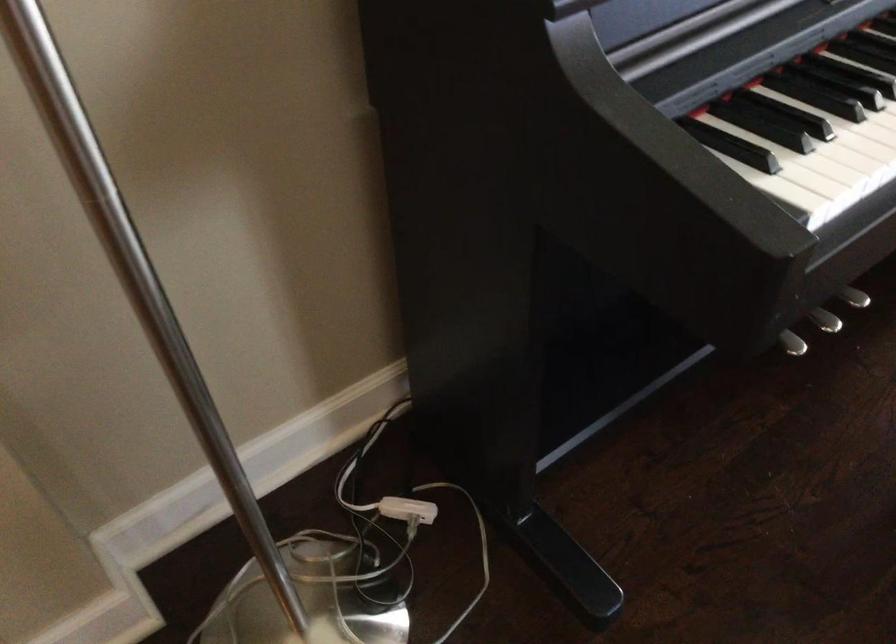
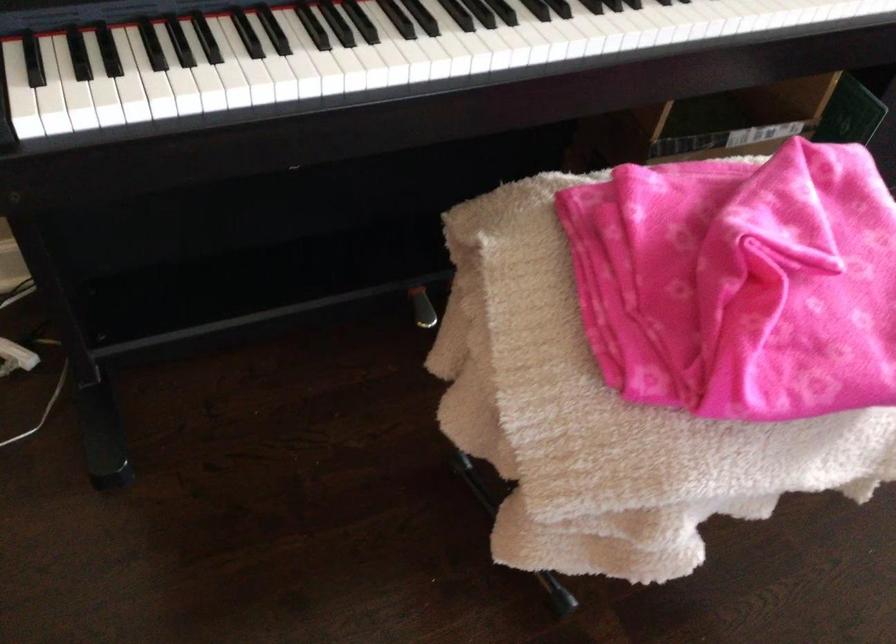
Question: Based on the continuous images, in which direction is the camera rotating? Reply with the corresponding letter.

Choices:
 (A) Left
 (B) Right
 (C) Up
 (D) Down

Answer: (D)